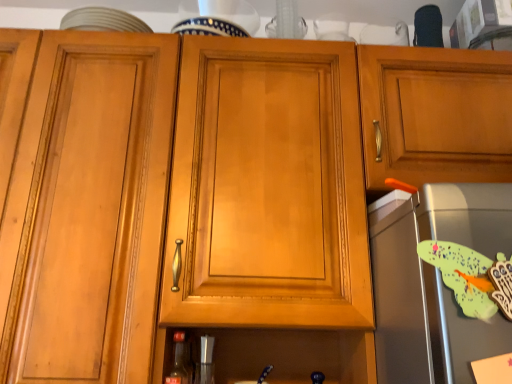
Question: Is satin silver toaster at right, which is the second appliance from left to right, looking in the opposite direction of matte glass bottle at lower center?

Choices:
 (A) yes
 (B) no

Answer: (B)

Question: Would you say satin silver toaster at right, the 2th appliance from the back, contains matte glass bottle at lower center?

Choices:
 (A) no
 (B) yes

Answer: (A)

Question: From a real-world perspective, does satin silver toaster at right, the 2th appliance positioned from the bottom, stand above matte glass bottle at lower center?

Choices:
 (A) no
 (B) yes

Answer: (B)

Question: Are satin silver toaster at right, the 1th appliance viewed from the top, and matte glass bottle at lower center beside each other?

Choices:
 (A) no
 (B) yes

Answer: (A)

Question: Is satin silver toaster at right, positioned as the 1th appliance in front-to-back order, not near matte glass bottle at lower center?

Choices:
 (A) no
 (B) yes

Answer: (A)

Question: Looking at the image, does matte glass bottle at lower center seem bigger or smaller compared to satin silver toaster at right, which is the second appliance from left to right?

Choices:
 (A) big
 (B) small

Answer: (B)

Question: From the image's perspective, is matte glass bottle at lower center positioned above or below satin silver toaster at right, the 1th appliance viewed from the top?

Choices:
 (A) above
 (B) below

Answer: (B)

Question: Based on their positions, is matte glass bottle at lower center located to the left or right of satin silver toaster at right, the 2th appliance from the back?

Choices:
 (A) right
 (B) left

Answer: (B)

Question: Relative to satin silver toaster at right, which is the second appliance from left to right, is matte glass bottle at lower center in front or behind?

Choices:
 (A) behind
 (B) front

Answer: (A)

Question: Does point (200, 337) appear closer or farther from the camera than point (181, 334)?

Choices:
 (A) farther
 (B) closer

Answer: (A)

Question: Visually, is metallic silver shaker at lower center, arranged as the first appliance when viewed from the left, positioned to the left or to the right of matte glass bottle at lower center?

Choices:
 (A) left
 (B) right

Answer: (B)

Question: From a real-world perspective, is metallic silver shaker at lower center, arranged as the first appliance when viewed from the left, positioned above or below matte glass bottle at lower center?

Choices:
 (A) below
 (B) above

Answer: (A)

Question: In terms of height, does metallic silver shaker at lower center, the first appliance ordered from the bottom, look taller or shorter compared to matte glass bottle at lower center?

Choices:
 (A) tall
 (B) short

Answer: (B)

Question: Considering their positions, is matte glass bottle at lower center located in front of or behind metallic silver shaker at lower center, which ranks as the 2th appliance in front-to-back order?

Choices:
 (A) front
 (B) behind

Answer: (A)

Question: Visually, is matte glass bottle at lower center positioned to the left or to the right of metallic silver shaker at lower center, arranged as the 2th appliance when viewed from the top?

Choices:
 (A) right
 (B) left

Answer: (B)